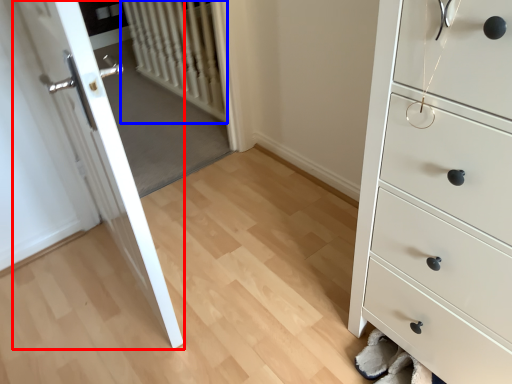
Question: Which object appears farthest to the camera in this image, door (highlighted by a red box) or radiator (highlighted by a blue box)?

Choices:
 (A) door
 (B) radiator

Answer: (B)